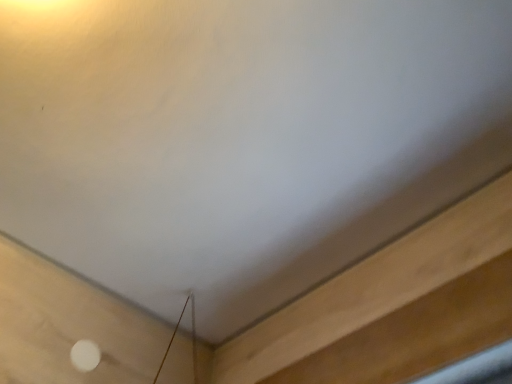
This screenshot has width=512, height=384. Describe the element at coordinates (393, 306) in the screenshot. I see `light brown wood at lower right` at that location.

This screenshot has width=512, height=384. Find the location of `light brown wood at lower right`. light brown wood at lower right is located at coordinates (393, 306).

What do you see at coordinates (85, 355) in the screenshot? I see `white matte dot at lower left` at bounding box center [85, 355].

Where is `white matte dot at lower left`? This screenshot has height=384, width=512. white matte dot at lower left is located at coordinates (85, 355).

The image size is (512, 384). I want to click on light brown wood at lower right, so pos(393,306).

Considering the relative positions of light brown wood at lower right and white matte dot at lower left in the image provided, is light brown wood at lower right to the left or to the right of white matte dot at lower left?

light brown wood at lower right is to the right of white matte dot at lower left.

Does light brown wood at lower right lie behind white matte dot at lower left?

That is False.

Is point (227, 360) less distant than point (81, 353)?

No, (227, 360) is behind (81, 353).

From the image's perspective, which is above, light brown wood at lower right or white matte dot at lower left?

light brown wood at lower right.

From a real-world perspective, is light brown wood at lower right under white matte dot at lower left?

Yes, from a real-world perspective, light brown wood at lower right is under white matte dot at lower left.

Which object is thinner, light brown wood at lower right or white matte dot at lower left?

With smaller width is white matte dot at lower left.

Considering the sizes of light brown wood at lower right and white matte dot at lower left in the image, is light brown wood at lower right taller or shorter than white matte dot at lower left?

In the image, light brown wood at lower right appears to be taller than white matte dot at lower left.

Is light brown wood at lower right bigger than white matte dot at lower left?

Indeed, light brown wood at lower right has a larger size compared to white matte dot at lower left.

Is light brown wood at lower right completely or partially outside of white matte dot at lower left?

That's correct, light brown wood at lower right is outside of white matte dot at lower left.

Is light brown wood at lower right touching white matte dot at lower left?

A: No, light brown wood at lower right is not making contact with white matte dot at lower left.

Is light brown wood at lower right turned away from white matte dot at lower left?

No, light brown wood at lower right is not facing away from white matte dot at lower left.

Where is `plywood below the white matte dot at lower left (from a real-world perspective)`? The image size is (512, 384). plywood below the white matte dot at lower left (from a real-world perspective) is located at coordinates (393, 306).

In the image, is white matte dot at lower left on the left side or the right side of light brown wood at lower right?

From the image, it's evident that white matte dot at lower left is to the left of light brown wood at lower right.

Between white matte dot at lower left and light brown wood at lower right, which one is positioned in front?

light brown wood at lower right.

Does point (87, 354) appear closer or farther from the camera than point (327, 351)?

Point (87, 354) is farther from the camera than point (327, 351).

From the image's perspective, which is below, white matte dot at lower left or light brown wood at lower right?

white matte dot at lower left.

From a real-world perspective, is white matte dot at lower left physically below light brown wood at lower right?

Actually, white matte dot at lower left is physically above light brown wood at lower right in the real world.

Considering the sizes of white matte dot at lower left and light brown wood at lower right in the image, is white matte dot at lower left wider or thinner than light brown wood at lower right?

In the image, white matte dot at lower left appears to be more narrow than light brown wood at lower right.

Considering the relative sizes of white matte dot at lower left and light brown wood at lower right in the image provided, is white matte dot at lower left taller than light brown wood at lower right?

In fact, white matte dot at lower left may be shorter than light brown wood at lower right.

Does white matte dot at lower left have a smaller size compared to light brown wood at lower right?

Indeed, white matte dot at lower left has a smaller size compared to light brown wood at lower right.

Could light brown wood at lower right be considered to be inside white matte dot at lower left?

No.

Is white matte dot at lower left placed right next to light brown wood at lower right?

white matte dot at lower left is not next to light brown wood at lower right, and they're not touching.

Is white matte dot at lower left aimed at light brown wood at lower right?

No, white matte dot at lower left does not turn towards light brown wood at lower right.

At what (x,y) coordinates should I click in order to perform the action: click on plywood on the right side of white matte dot at lower left. Please return your answer as a coordinate pair (x, y). Looking at the image, I should click on (393, 306).

Locate an element on the screen. This screenshot has height=384, width=512. dot on the left of light brown wood at lower right is located at coordinates (85, 355).

In the image, there is a white matte dot at lower left. Identify the location of plywood below it (from a real-world perspective). Image resolution: width=512 pixels, height=384 pixels. (393, 306).